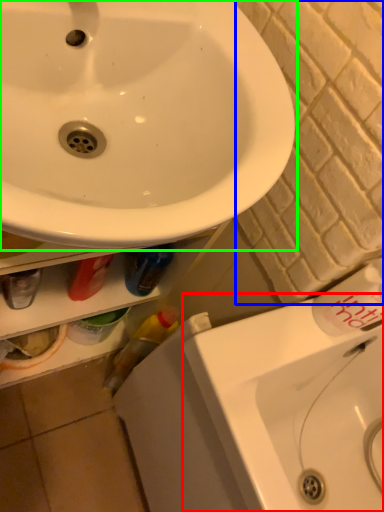
Question: Which object is positioned farthest from counter top (highlighted by a red box)? Select from brick (highlighted by a blue box) and sink (highlighted by a green box).

Choices:
 (A) brick
 (B) sink

Answer: (B)